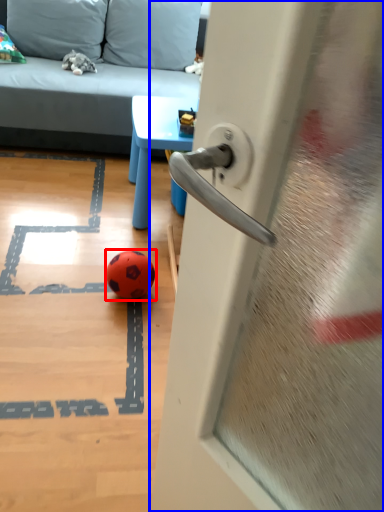
Question: Which object appears closest to the camera in this image, ball (highlighted by a red box) or door (highlighted by a blue box)?

Choices:
 (A) ball
 (B) door

Answer: (B)